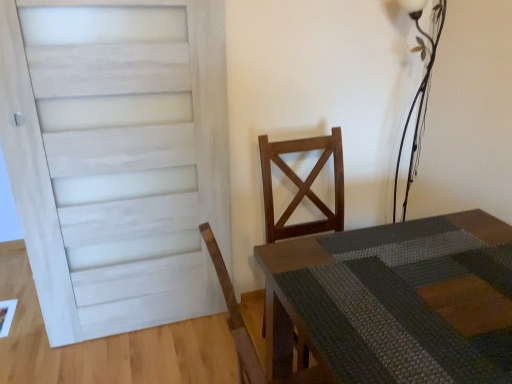
Question: Is metallic wire at upper right in contact with rustic wood table at center?

Choices:
 (A) no
 (B) yes

Answer: (A)

Question: Does metallic wire at upper right appear on the right side of rustic wood table at center?

Choices:
 (A) yes
 (B) no

Answer: (A)

Question: Would you consider metallic wire at upper right to be distant from rustic wood table at center?

Choices:
 (A) no
 (B) yes

Answer: (B)

Question: Does metallic wire at upper right appear on the left side of rustic wood table at center?

Choices:
 (A) no
 (B) yes

Answer: (A)

Question: Does metallic wire at upper right have a lesser height compared to rustic wood table at center?

Choices:
 (A) no
 (B) yes

Answer: (A)

Question: Is rustic wood table at center surrounded by metallic wire at upper right?

Choices:
 (A) no
 (B) yes

Answer: (A)

Question: Does wooden chair at center turn towards white painted wood door at left?

Choices:
 (A) yes
 (B) no

Answer: (B)

Question: Are wooden chair at center and white painted wood door at left located far from each other?

Choices:
 (A) yes
 (B) no

Answer: (B)

Question: Does wooden chair at center have a greater height compared to white painted wood door at left?

Choices:
 (A) yes
 (B) no

Answer: (B)

Question: Considering the relative sizes of wooden chair at center and white painted wood door at left in the image provided, is wooden chair at center thinner than white painted wood door at left?

Choices:
 (A) yes
 (B) no

Answer: (B)

Question: Is wooden chair at center located outside white painted wood door at left?

Choices:
 (A) yes
 (B) no

Answer: (A)

Question: Is white painted wood door at left at the back of wooden chair at center?

Choices:
 (A) no
 (B) yes

Answer: (A)

Question: From the image's perspective, does rustic wood table at center appear lower than metallic wire at upper right?

Choices:
 (A) yes
 (B) no

Answer: (A)